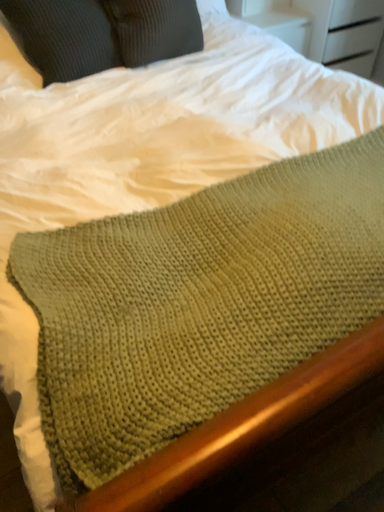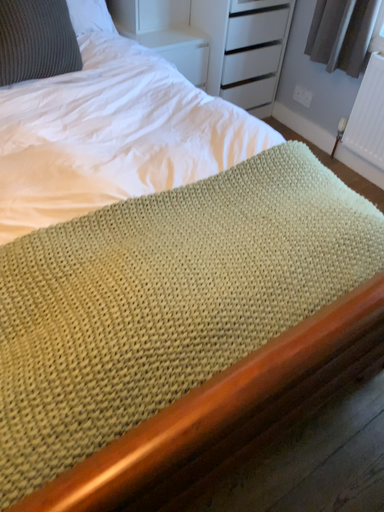
Question: How did the camera likely rotate when shooting the video?

Choices:
 (A) rotated left
 (B) rotated right

Answer: (B)